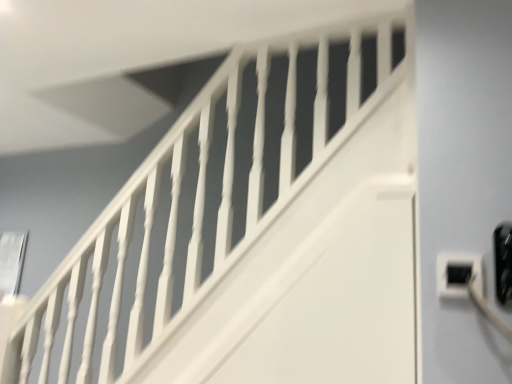
Measure the distance between black plastic electric outlet at lower right and camera.

black plastic electric outlet at lower right and camera are 34.61 inches apart from each other.

This screenshot has width=512, height=384. Identify the location of black plastic electric outlet at lower right. (458, 274).

This screenshot has width=512, height=384. What do you see at coordinates (458, 274) in the screenshot?
I see `black plastic electric outlet at lower right` at bounding box center [458, 274].

Identify the location of black plastic electric outlet at lower right. The image size is (512, 384). (458, 274).